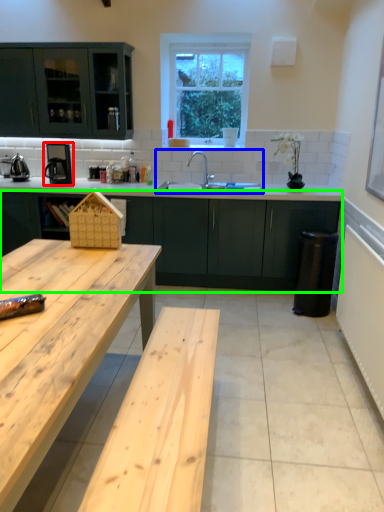
Question: Which object is the farthest from coffee machine (highlighted by a red box)? Choose among these: sink (highlighted by a blue box) or cabinetry (highlighted by a green box).

Choices:
 (A) sink
 (B) cabinetry

Answer: (B)